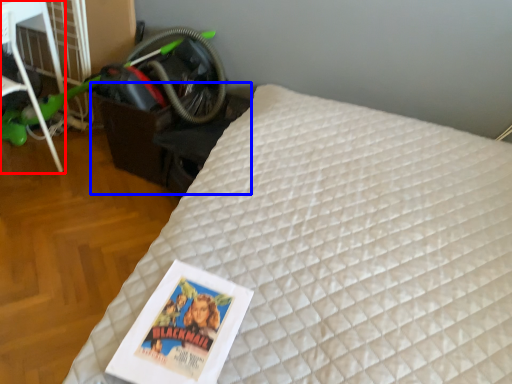
Question: Among these objects, which one is nearest to the camera, furniture (highlighted by a red box) or table (highlighted by a blue box)?

Choices:
 (A) furniture
 (B) table

Answer: (A)